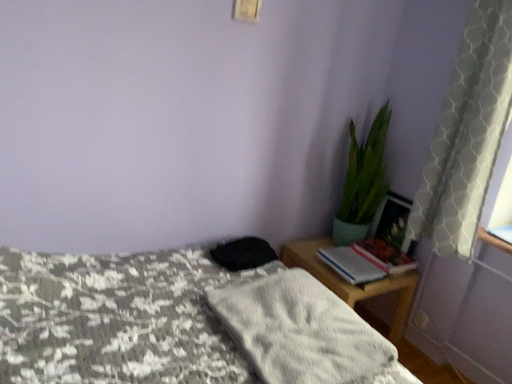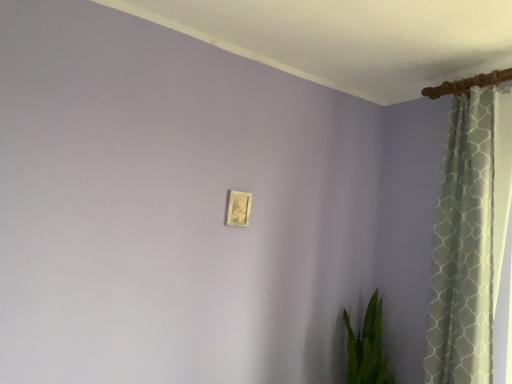
Question: Which way did the camera rotate in the video?

Choices:
 (A) rotated upward
 (B) rotated downward

Answer: (A)